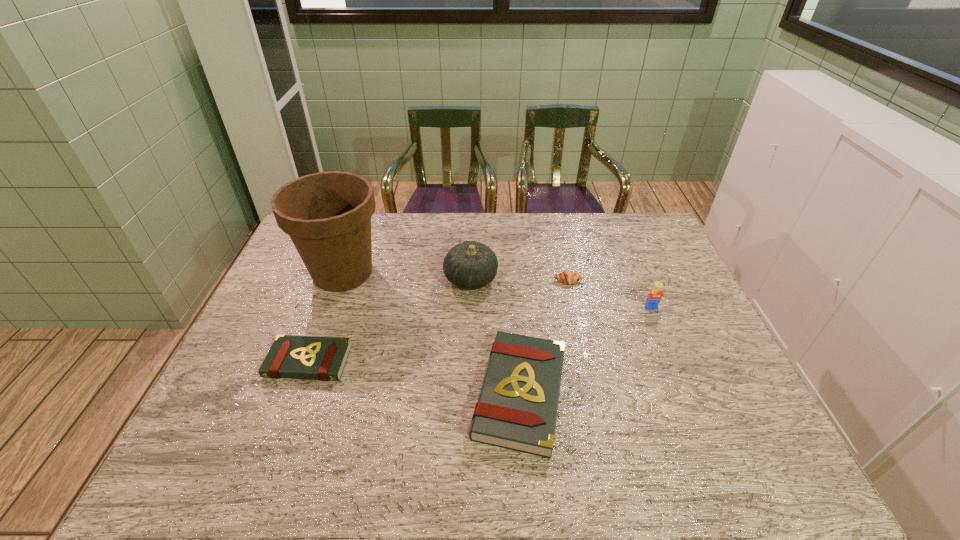
The width and height of the screenshot is (960, 540). I want to click on the shortest object, so click(294, 357).

This screenshot has height=540, width=960. In order to click on the shorter book in this screenshot , I will do [294, 357].

Where is `the right book`? the right book is located at coordinates (517, 409).

Where is `the fourth tallest object`? This screenshot has height=540, width=960. the fourth tallest object is located at coordinates (517, 409).

The width and height of the screenshot is (960, 540). Find the location of `the second tallest object`. the second tallest object is located at coordinates (472, 265).

Identify the location of the third tallest object. This screenshot has height=540, width=960. click(x=656, y=294).

Where is `the rightmost object`? the rightmost object is located at coordinates 656,294.

Identify the location of the tallest object. (327, 215).

The height and width of the screenshot is (540, 960). I want to click on pastry, so click(567, 277).

Locate an element on the screen. The image size is (960, 540). vacant space located on the left of the shortest object is located at coordinates (235, 361).